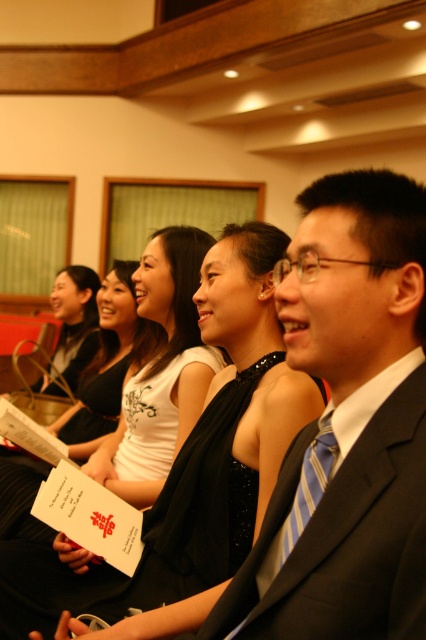
Question: Does dark gray suit at center lie behind white matte paper at center?

Choices:
 (A) yes
 (B) no

Answer: (B)

Question: Is white matte paper at center closer to the viewer compared to blue striped tie at right?

Choices:
 (A) yes
 (B) no

Answer: (B)

Question: Which object is positioned closest to the white matte paper at center?

Choices:
 (A) blue striped tie at right
 (B) dark gray suit at center

Answer: (B)

Question: Which object is positioned farthest from the dark gray suit at center?

Choices:
 (A) white matte paper at center
 (B) blue striped tie at right

Answer: (A)

Question: Is white matte paper at center in front of blue striped tie at right?

Choices:
 (A) yes
 (B) no

Answer: (B)

Question: Considering the real-world distances, which object is farthest from the dark gray suit at center?

Choices:
 (A) white matte paper at center
 (B) blue striped tie at right

Answer: (A)